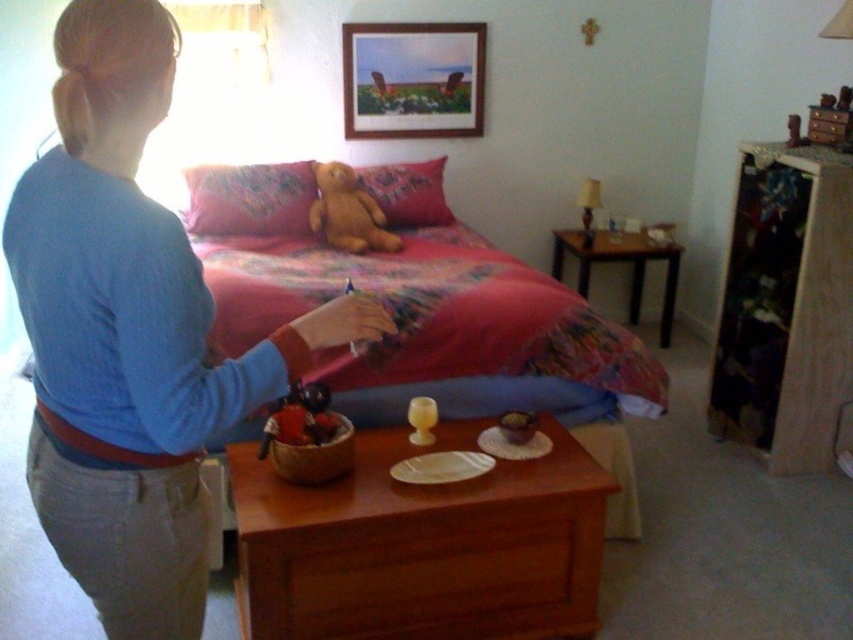
You are organizing your closet and need to place the blue cotton shirt at upper left. According to the image, where exactly should you position it?

The blue cotton shirt at upper left should be positioned at point (131, 333) as specified in the description.

You are organizing your closet and notice the blue cotton shirt at upper left and the fluffy fabric bed at center in your room. Which item is positioned more to the left side of the room?

The blue cotton shirt at upper left is positioned more to the left side of the room than the fluffy fabric bed at center.